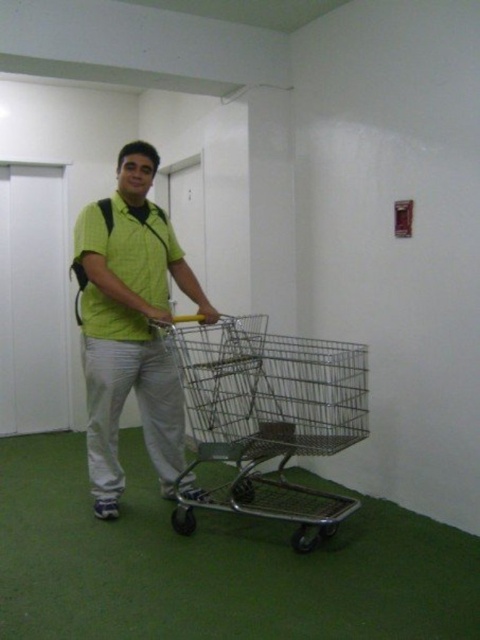
Question: Considering the relative positions of green matte shirt at center and green matte polo shirt at center in the image provided, where is green matte shirt at center located with respect to green matte polo shirt at center?

Choices:
 (A) below
 (B) above

Answer: (A)

Question: Among these objects, which one is farthest from the camera?

Choices:
 (A) green matte shirt at center
 (B) green matte polo shirt at center
 (C) metallic wire trolley at center

Answer: (B)

Question: From the image, what is the correct spatial relationship of green matte shirt at center in relation to green matte polo shirt at center?

Choices:
 (A) below
 (B) above

Answer: (A)

Question: Does metallic wire trolley at center lie behind green matte shirt at center?

Choices:
 (A) yes
 (B) no

Answer: (B)

Question: Which object is farther from the camera taking this photo?

Choices:
 (A) metallic wire trolley at center
 (B) green matte polo shirt at center
 (C) green matte shirt at center

Answer: (B)

Question: Which point is farther to the camera?

Choices:
 (A) (178, 246)
 (B) (84, 211)

Answer: (A)